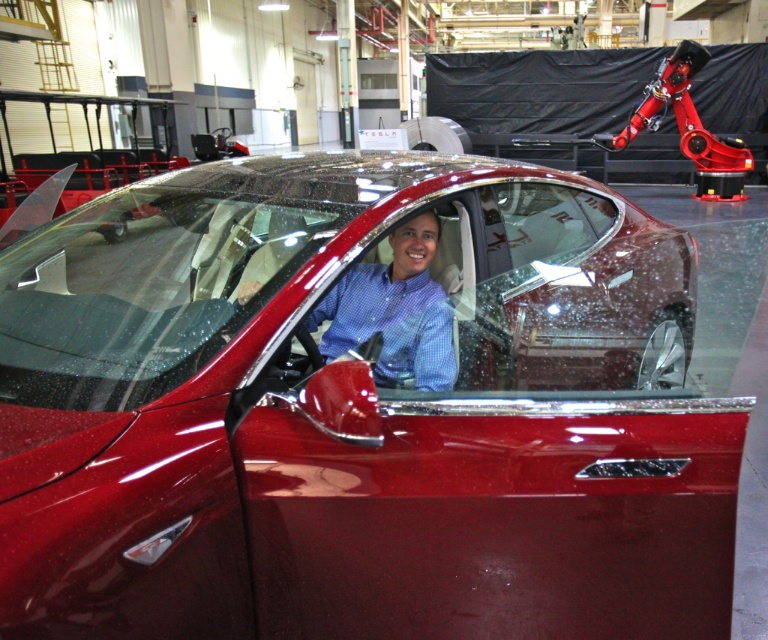
Question: Which point is closer to the camera taking this photo?

Choices:
 (A) click(371, 332)
 (B) click(525, 170)

Answer: (A)

Question: Does clear glass windshield at center have a lesser width compared to blue checkered shirt at center?

Choices:
 (A) yes
 (B) no

Answer: (B)

Question: Which point appears closest to the camera in this image?

Choices:
 (A) (273, 195)
 (B) (348, 314)

Answer: (A)

Question: Does clear glass windshield at center come behind blue checkered shirt at center?

Choices:
 (A) no
 (B) yes

Answer: (A)

Question: Does clear glass windshield at center have a greater width compared to blue checkered shirt at center?

Choices:
 (A) yes
 (B) no

Answer: (A)

Question: Among these objects, which one is nearest to the camera?

Choices:
 (A) clear glass windshield at center
 (B) blue checkered shirt at center

Answer: (A)